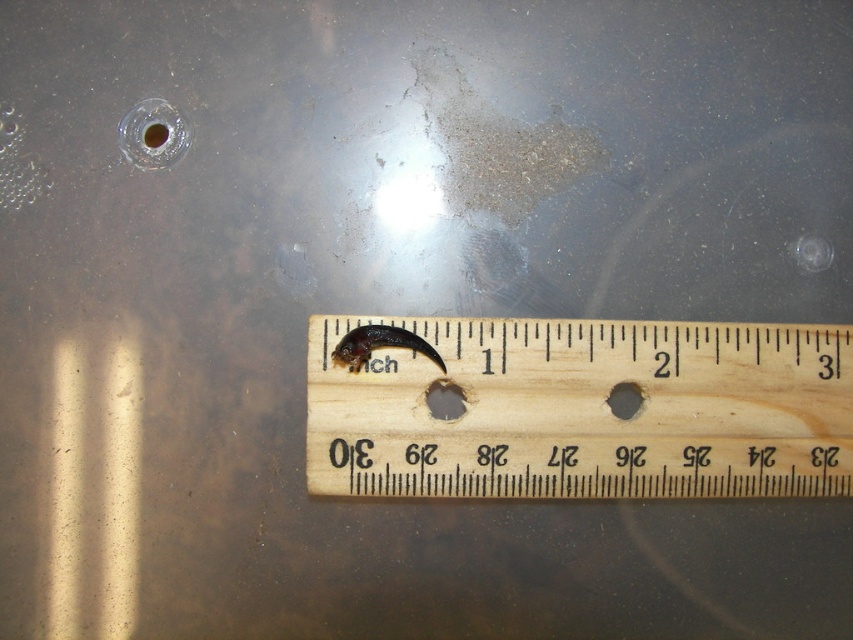
Question: Does wooden ruler at center appear over matte plastic hole at center?

Choices:
 (A) yes
 (B) no

Answer: (B)

Question: From the image, what is the correct spatial relationship of wooden ruler at center in relation to matte black hole at center?

Choices:
 (A) right
 (B) left

Answer: (B)

Question: Which of these objects is positioned closest to the matte black hole at center?

Choices:
 (A) matte plastic hole at center
 (B) black rubber insect at center

Answer: (A)

Question: Among these objects, which one is nearest to the camera?

Choices:
 (A) matte black hole at center
 (B) black rubber insect at center
 (C) matte plastic hole at center
 (D) wooden ruler at center

Answer: (D)

Question: Is wooden ruler at center behind black rubber insect at center?

Choices:
 (A) yes
 (B) no

Answer: (B)

Question: Estimate the real-world distances between objects in this image. Which object is closer to the matte black hole at center?

Choices:
 (A) matte plastic hole at center
 (B) wooden ruler at center

Answer: (B)